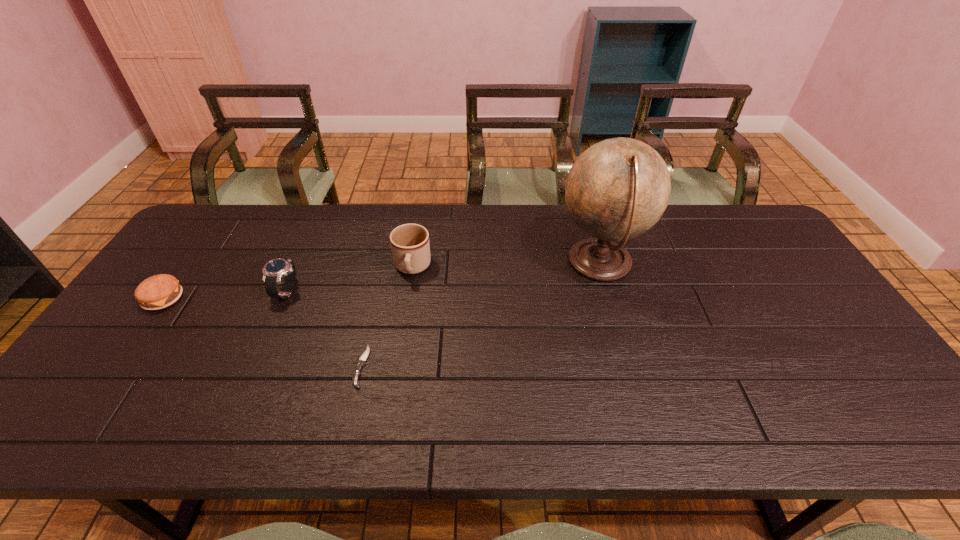
You are a GUI agent. You are given a task and a screenshot of the screen. Output one action in this format:
    pyautogui.click(x=<x>, y=<y>)
    Task: Click on the free space that is in between the rightmost object and the mug
    The width and height of the screenshot is (960, 540).
    Given the screenshot: What is the action you would take?
    pyautogui.click(x=506, y=266)

What are the coordinates of `vacant space in between the leftmost object and the fourth object from right to left` in the screenshot? It's located at (226, 295).

The image size is (960, 540). I want to click on object that can be found as the fourth closest to the watch, so click(617, 189).

Select which object is the second closest to the tallest object. Please provide its 2D coordinates. Your answer should be formatted as a tuple, i.e. [(x, y)], where the tuple contains the x and y coordinates of a point satisfying the conditions above.

[(357, 372)]

Image resolution: width=960 pixels, height=540 pixels. I want to click on vacant area that satisfies the following two spatial constraints: 1. on the front side of the nearest object; 2. on the right side of the second shortest object, so click(x=114, y=366).